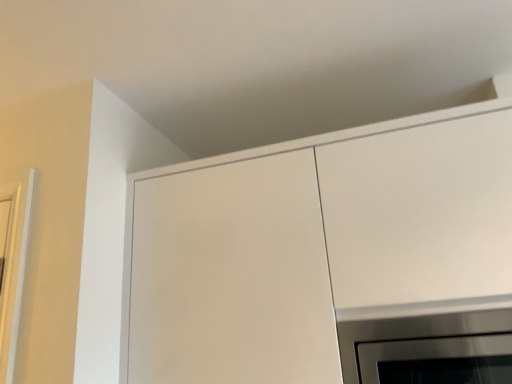
Question: Is stainless steel oven at lower right a part of white matte cabinet at upper center?

Choices:
 (A) no
 (B) yes

Answer: (B)

Question: Is white matte cabinet at upper center aimed at stainless steel oven at lower right?

Choices:
 (A) no
 (B) yes

Answer: (B)

Question: Are white matte cabinet at upper center and stainless steel oven at lower right located far from each other?

Choices:
 (A) no
 (B) yes

Answer: (A)

Question: Is white matte cabinet at upper center closer to camera compared to stainless steel oven at lower right?

Choices:
 (A) no
 (B) yes

Answer: (B)

Question: Considering the relative sizes of white matte cabinet at upper center and stainless steel oven at lower right in the image provided, is white matte cabinet at upper center shorter than stainless steel oven at lower right?

Choices:
 (A) no
 (B) yes

Answer: (A)

Question: From a real-world perspective, is white matte cabinet at upper center located higher than stainless steel oven at lower right?

Choices:
 (A) yes
 (B) no

Answer: (A)

Question: Considering the relative positions of stainless steel oven at lower right and white matte cabinet at upper center in the image provided, is stainless steel oven at lower right to the left of white matte cabinet at upper center from the viewer's perspective?

Choices:
 (A) no
 (B) yes

Answer: (A)

Question: From the image's perspective, is stainless steel oven at lower right beneath white matte cabinet at upper center?

Choices:
 (A) no
 (B) yes

Answer: (B)

Question: Is stainless steel oven at lower right beside white matte cabinet at upper center?

Choices:
 (A) yes
 (B) no

Answer: (B)

Question: Is stainless steel oven at lower right positioned beyond the bounds of white matte cabinet at upper center?

Choices:
 (A) yes
 (B) no

Answer: (B)

Question: Is stainless steel oven at lower right thinner than white matte cabinet at upper center?

Choices:
 (A) yes
 (B) no

Answer: (A)

Question: Considering the relative sizes of stainless steel oven at lower right and white matte cabinet at upper center in the image provided, is stainless steel oven at lower right taller than white matte cabinet at upper center?

Choices:
 (A) no
 (B) yes

Answer: (A)

Question: From the image's perspective, relative to white matte cabinet at upper center, is stainless steel oven at lower right above or below?

Choices:
 (A) above
 (B) below

Answer: (B)